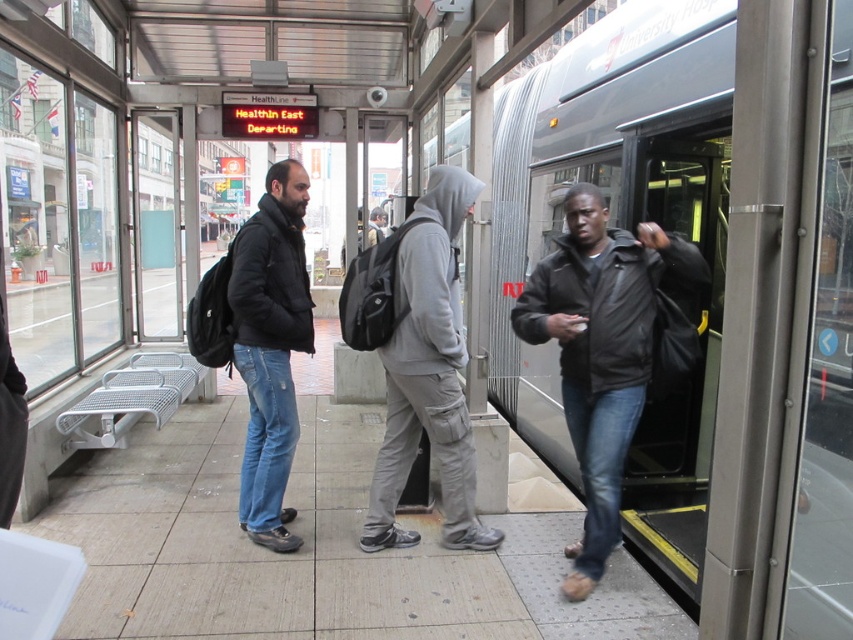
Question: Among these objects, which one is nearest to the camera?

Choices:
 (A) metallic gray train at center
 (B) matte black jacket at center
 (C) gray hoodie at center

Answer: (C)

Question: Which of the following is the closest to the observer?

Choices:
 (A) (270, 340)
 (B) (432, 184)
 (C) (712, 292)

Answer: (B)

Question: Based on their relative distances, which object is nearer to the dark brown leather jacket at right?

Choices:
 (A) matte black jacket at center
 (B) metallic gray train at center

Answer: (B)

Question: Is metallic gray train at center positioned at the back of gray hoodie at center?

Choices:
 (A) no
 (B) yes

Answer: (B)

Question: Does dark brown leather jacket at right come behind matte black jacket at center?

Choices:
 (A) yes
 (B) no

Answer: (B)

Question: Does metallic gray train at center appear on the left side of dark brown leather jacket at right?

Choices:
 (A) yes
 (B) no

Answer: (B)